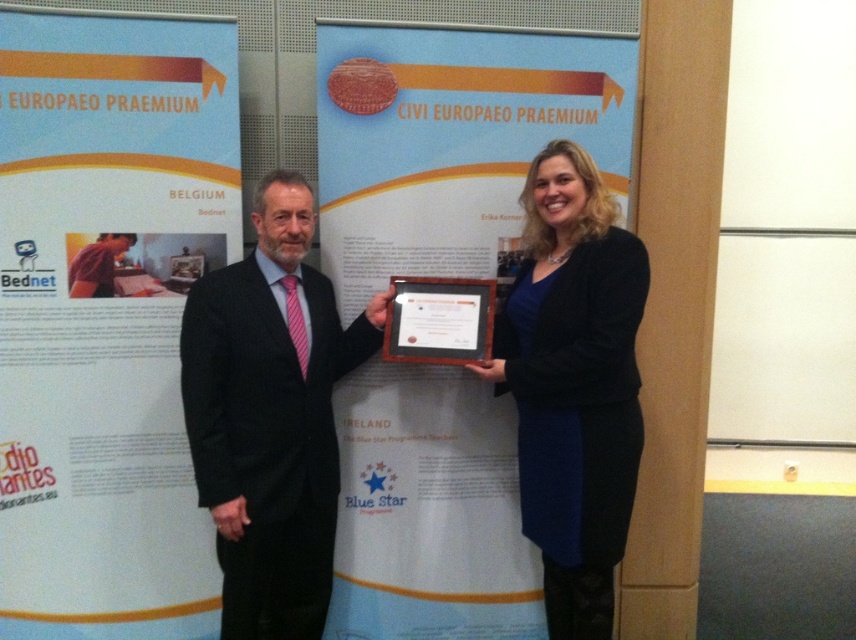
Question: Does black suit at center have a smaller size compared to matte pink shirt at left?

Choices:
 (A) no
 (B) yes

Answer: (A)

Question: Does white paperboard poster at upper left come behind black matte cardigan at center?

Choices:
 (A) yes
 (B) no

Answer: (A)

Question: Which object is positioned closest to the black suit at center?

Choices:
 (A) white paperboard poster at upper left
 (B) white paperboard at center
 (C) wooden plaque at center

Answer: (C)

Question: Which object appears farthest from the camera in this image?

Choices:
 (A) white paperboard at center
 (B) white paperboard poster at upper left
 (C) matte pink shirt at left

Answer: (A)

Question: Is white paperboard poster at upper left wider than black matte cardigan at center?

Choices:
 (A) yes
 (B) no

Answer: (A)

Question: Among these objects, which one is nearest to the camera?

Choices:
 (A) white paperboard poster at upper left
 (B) white paperboard at center
 (C) wooden plaque at center

Answer: (C)